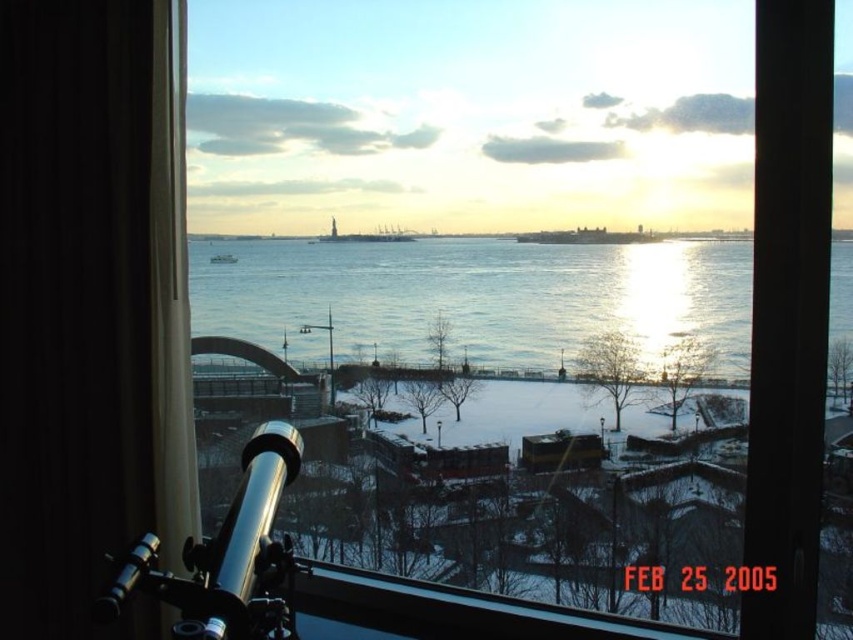
Question: Considering the relative positions of clear blue water at center and white plastic boat at center in the image provided, where is clear blue water at center located with respect to white plastic boat at center?

Choices:
 (A) below
 (B) above

Answer: (A)

Question: Observing the image, what is the correct spatial positioning of clear blue water at center in reference to white plastic boat at center?

Choices:
 (A) left
 (B) right

Answer: (B)

Question: Which object is closer to the camera taking this photo?

Choices:
 (A) white plastic boat at center
 (B) polished silver telescope at lower left
 (C) clear blue water at center

Answer: (B)

Question: Which object is farther from the camera taking this photo?

Choices:
 (A) polished silver telescope at lower left
 (B) clear blue water at center

Answer: (B)

Question: Which point is closer to the camera?

Choices:
 (A) (225, 260)
 (B) (254, 586)

Answer: (B)

Question: Is polished silver telescope at lower left wider than white plastic boat at center?

Choices:
 (A) no
 (B) yes

Answer: (B)